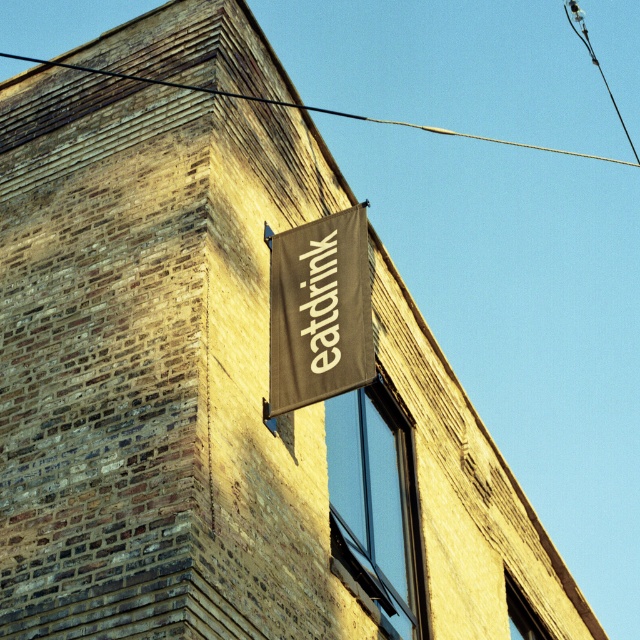
Question: Does brown canvas sign at upper center have a larger size compared to black wire at upper center?

Choices:
 (A) no
 (B) yes

Answer: (A)

Question: Is brown canvas sign at upper center behind black wire at upper center?

Choices:
 (A) yes
 (B) no

Answer: (B)

Question: Can you confirm if brown canvas sign at upper center is wider than black wire at upper center?

Choices:
 (A) yes
 (B) no

Answer: (B)

Question: Which object is farther from the camera taking this photo?

Choices:
 (A) brown canvas sign at upper center
 (B) black wire at upper center

Answer: (B)